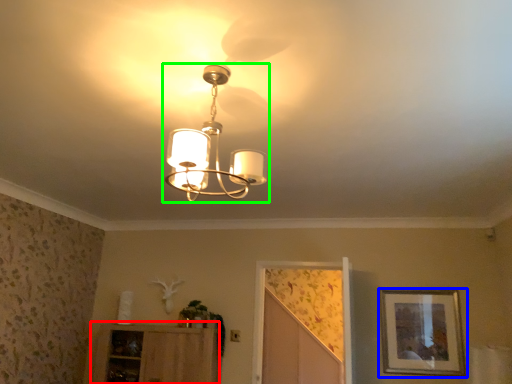
Question: Estimate the real-world distances between objects in this image. Which object is closer to cabinetry (highlighted by a red box), picture frame (highlighted by a blue box) or lamp (highlighted by a green box)?

Choices:
 (A) picture frame
 (B) lamp

Answer: (A)